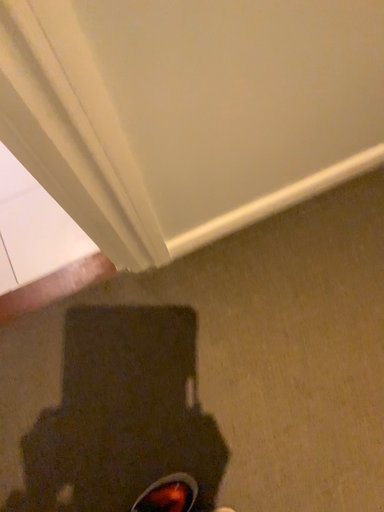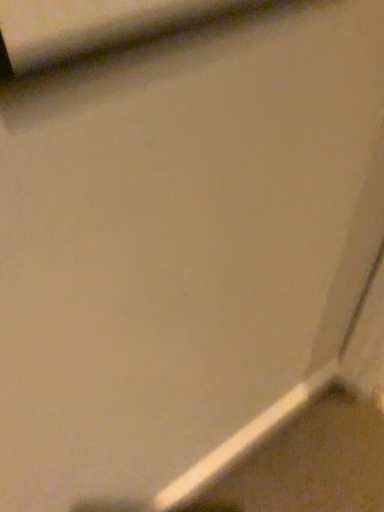
Question: How did the camera likely rotate when shooting the video?

Choices:
 (A) rotated downward
 (B) rotated upward

Answer: (B)